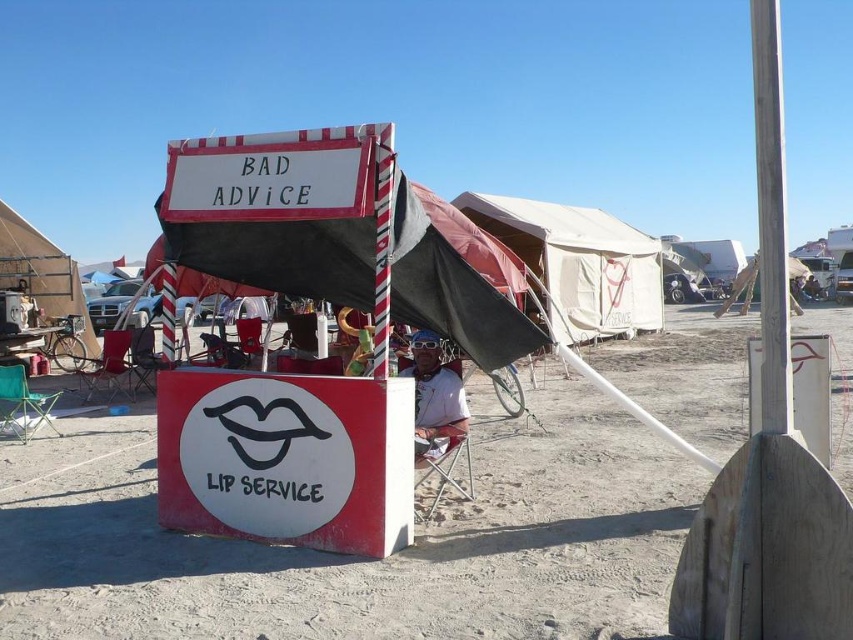
Question: Considering the real-world distances, which object is closest to the green fabric folding chair at lower left?

Choices:
 (A) metallic folding chair at center
 (B) white fabric shirt at center

Answer: (A)

Question: Which point is closer to the camera?

Choices:
 (A) (775, 134)
 (B) (187, 241)
 (C) (152, 333)

Answer: (A)

Question: Does white matte sign at center have a lesser width compared to red and white striped pole at center?

Choices:
 (A) no
 (B) yes

Answer: (A)

Question: Is dirt sand at center to the right of white wood pole at right from the viewer's perspective?

Choices:
 (A) yes
 (B) no

Answer: (B)

Question: Which object is positioned closest to the white matte sign at center?

Choices:
 (A) matte black tent at left
 (B) white painted wood sign at upper center
 (C) white wood pole at right

Answer: (C)

Question: Is white fabric shirt at center bigger than red and white striped pole at center?

Choices:
 (A) no
 (B) yes

Answer: (B)